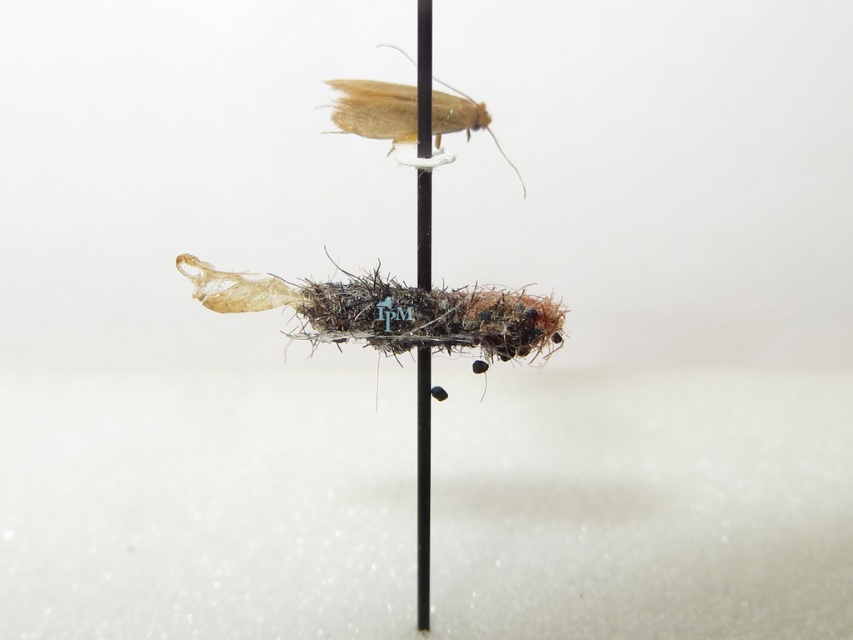
Question: Which point appears closest to the camera in this image?

Choices:
 (A) (409, 157)
 (B) (492, 349)

Answer: (A)

Question: Does fuzzy brown caterpillar at center have a larger size compared to translucent beige moth at upper center?

Choices:
 (A) yes
 (B) no

Answer: (B)

Question: Which point appears farthest from the camera in this image?

Choices:
 (A) (399, 122)
 (B) (357, 301)

Answer: (B)

Question: Is fuzzy brown caterpillar at center wider than translucent beige moth at upper center?

Choices:
 (A) yes
 (B) no

Answer: (A)

Question: Which point is farther from the camera taking this photo?

Choices:
 (A) (376, 109)
 (B) (553, 333)

Answer: (B)

Question: Is fuzzy brown caterpillar at center positioned at the back of translucent beige moth at upper center?

Choices:
 (A) no
 (B) yes

Answer: (B)